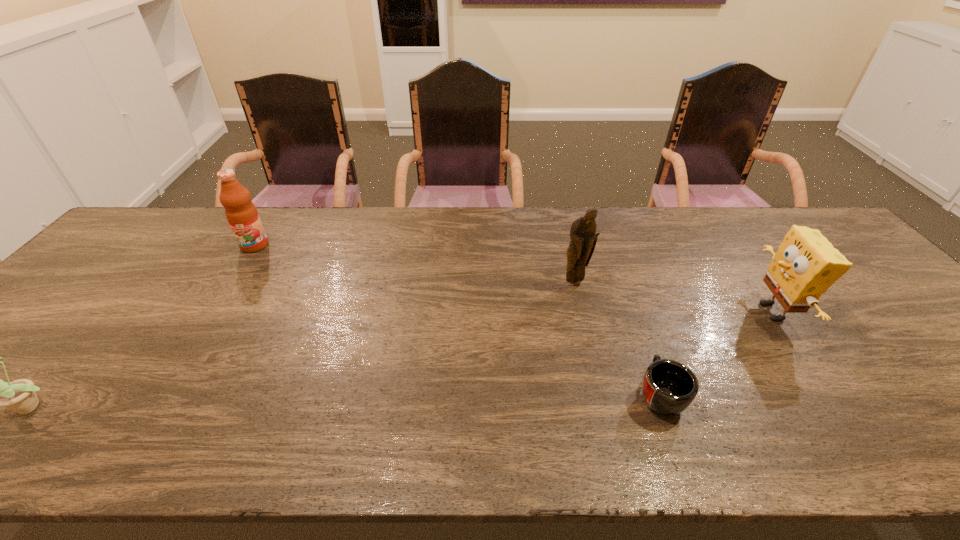
I want to click on vacant area located on the face of the rightmost object, so click(697, 312).

At what (x,y) coordinates should I click in order to perform the action: click on vacant space situated on the side of the shortest object with the handle. Please return your answer as a coordinate pair (x, y). The image size is (960, 540). Looking at the image, I should click on pyautogui.click(x=639, y=339).

Locate an element on the screen. This screenshot has height=540, width=960. free space located on the side of the shortest object with the handle is located at coordinates (613, 265).

This screenshot has width=960, height=540. Identify the location of free location located on the side of the shortest object with the handle. (636, 329).

Find the location of a particular element. This screenshot has width=960, height=540. object that is at the far edge is located at coordinates (242, 215).

I want to click on object present at the near edge, so click(x=669, y=387).

Locate an element on the screen. free space at the far edge of the desktop is located at coordinates (418, 221).

Where is `free space at the near edge of the desktop`? The height and width of the screenshot is (540, 960). free space at the near edge of the desktop is located at coordinates (918, 456).

In the image, there is a desktop. At what (x,y) coordinates should I click in order to perform the action: click on vacant space at the left edge. Please return your answer as a coordinate pair (x, y). The image size is (960, 540). Looking at the image, I should click on (89, 331).

Find the location of `vacant region at the right edge of the desktop`. vacant region at the right edge of the desktop is located at coordinates (899, 301).